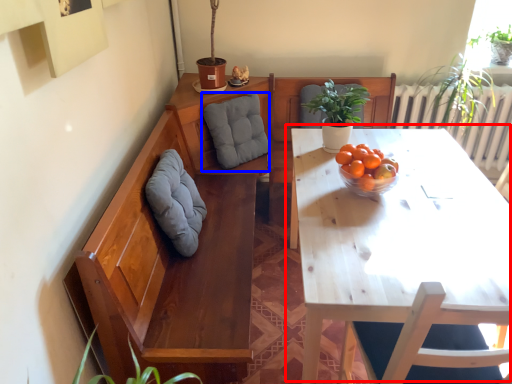
Question: Which object is further to the camera taking this photo, table (highlighted by a red box) or gray (highlighted by a blue box)?

Choices:
 (A) table
 (B) gray

Answer: (B)